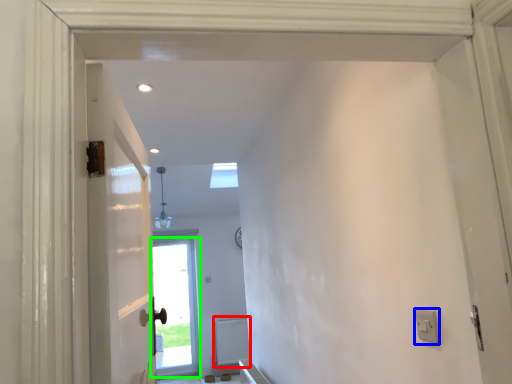
Question: Estimate the real-world distances between objects in this image. Which object is closer to radiator (highlighted by a red box), electric outlet (highlighted by a blue box) or door (highlighted by a green box)?

Choices:
 (A) electric outlet
 (B) door

Answer: (B)